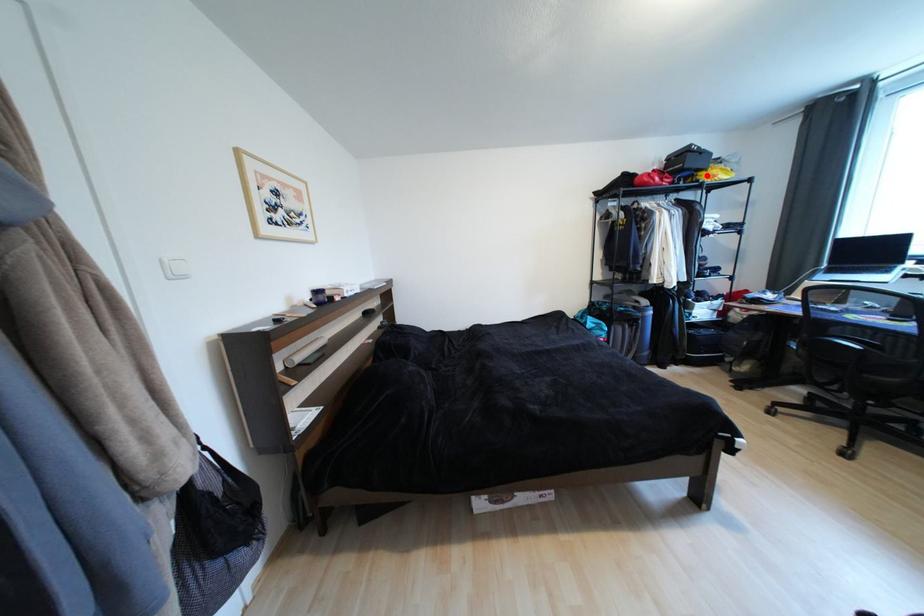
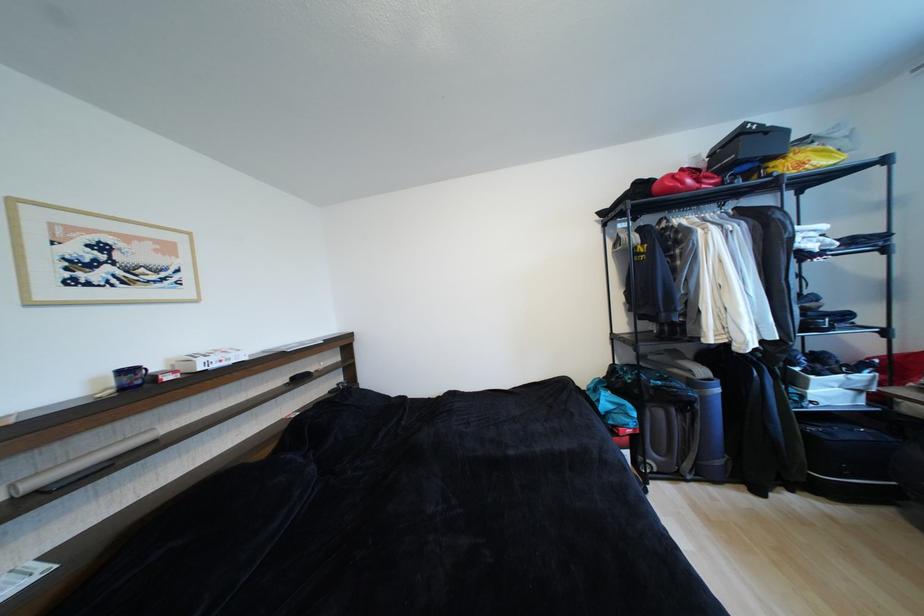
The point at the highlighted location is marked in the first image. Where is the corresponding point in the second image?

(780, 166)